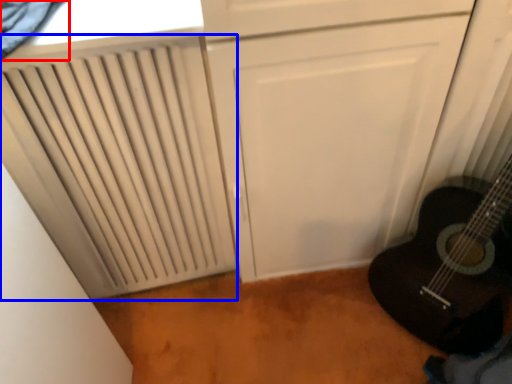
Question: Which of the following is the closest to the observer, curtain (highlighted by a red box) or radiator (highlighted by a blue box)?

Choices:
 (A) curtain
 (B) radiator

Answer: (A)